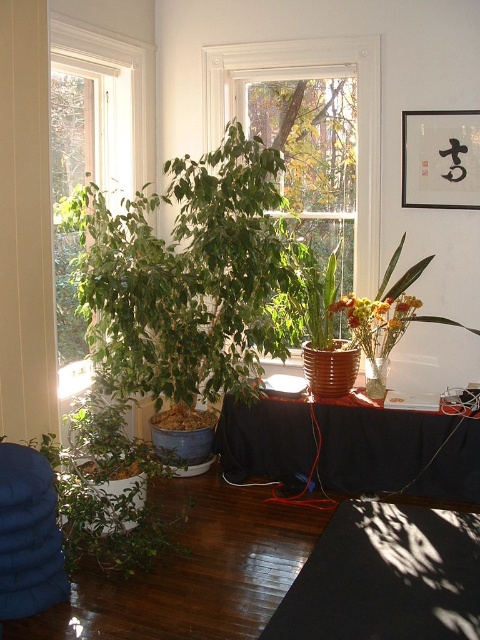
You are designing a room layout and need to place a large piece of furniture that requires the most space. Which window should you avoid placing it near to ensure there is enough space? Please refer to the white wood window at center and the white frame window at left.

You should avoid placing the large furniture near the white wood window at center because it is larger in size than the white frame window at left, leaving less space around it for the furniture.